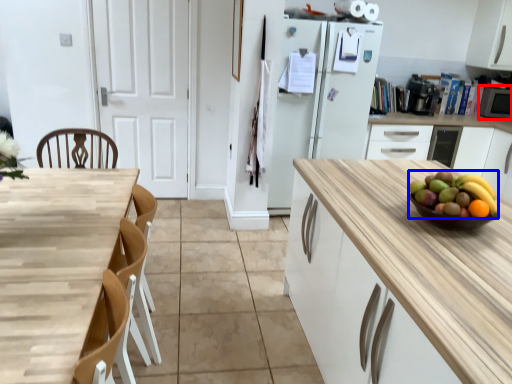
Question: Which object is further to the camera taking this photo, appliance (highlighted by a red box) or grapefruit (highlighted by a blue box)?

Choices:
 (A) appliance
 (B) grapefruit

Answer: (A)